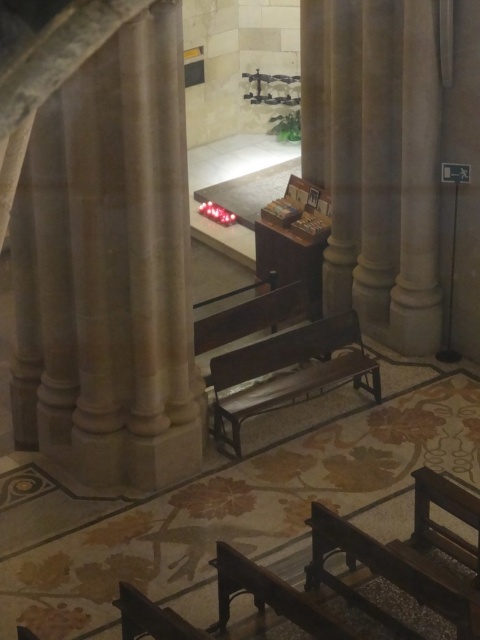
You are a visitor standing at the entrance of the church and want to sit down. You see the beige stone pillar at left and the wooden bench at center. Which one is taller and can you use it to rest your hand?

The beige stone pillar at left is taller than the wooden bench at center. You can rest your hand on the beige stone pillar at left since it is taller and provides a higher surface.

You are a tour guide leading a group in the church. You need to move a 5 feet long banner from the beige stone pillar at left to the wooden bench at center. Will the banner fit through the space between them?

The distance between the beige stone pillar at left and the wooden bench at center is 4.76 feet. Since the banner is 5 feet long, it will not fit through the space between them as the distance is shorter than the banner.